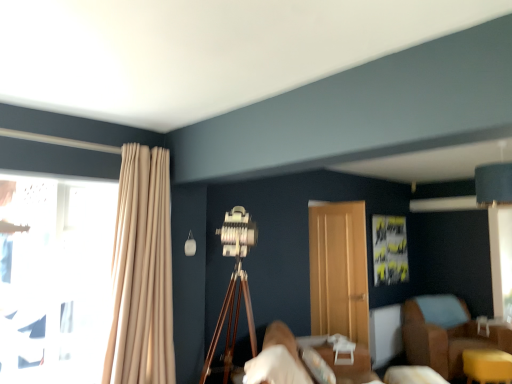
Question: Can we say wooden door at center lies outside white fabric bed at lower center?

Choices:
 (A) no
 (B) yes

Answer: (B)

Question: Is wooden door at center shorter than white fabric bed at lower center?

Choices:
 (A) no
 (B) yes

Answer: (A)

Question: From a real-world perspective, is wooden door at center located higher than white fabric bed at lower center?

Choices:
 (A) yes
 (B) no

Answer: (A)

Question: From a real-world perspective, is wooden door at center beneath white fabric bed at lower center?

Choices:
 (A) yes
 (B) no

Answer: (B)

Question: Can you see wooden door at center touching white fabric bed at lower center?

Choices:
 (A) yes
 (B) no

Answer: (B)

Question: From the image's perspective, is white fabric bed at lower center positioned above or below wooden door at center?

Choices:
 (A) below
 (B) above

Answer: (A)

Question: In the image, is white fabric bed at lower center positioned in front of or behind wooden door at center?

Choices:
 (A) front
 (B) behind

Answer: (A)

Question: In terms of width, does white fabric bed at lower center look wider or thinner when compared to wooden door at center?

Choices:
 (A) thin
 (B) wide

Answer: (B)

Question: Would you say white fabric bed at lower center is inside or outside wooden door at center?

Choices:
 (A) outside
 (B) inside

Answer: (A)

Question: Is wooden door at center to the left or to the right of beige fabric curtain at left in the image?

Choices:
 (A) left
 (B) right

Answer: (B)

Question: In terms of height, does wooden door at center look taller or shorter compared to beige fabric curtain at left?

Choices:
 (A) tall
 (B) short

Answer: (A)

Question: Is wooden door at center bigger or smaller than beige fabric curtain at left?

Choices:
 (A) big
 (B) small

Answer: (B)

Question: Is wooden door at center inside or outside of beige fabric curtain at left?

Choices:
 (A) outside
 (B) inside

Answer: (A)

Question: From a real-world perspective, is beige fabric curtain at left positioned above or below transparent glass window at left?

Choices:
 (A) above
 (B) below

Answer: (A)

Question: Considering the positions of beige fabric curtain at left and transparent glass window at left in the image, is beige fabric curtain at left wider or thinner than transparent glass window at left?

Choices:
 (A) thin
 (B) wide

Answer: (B)